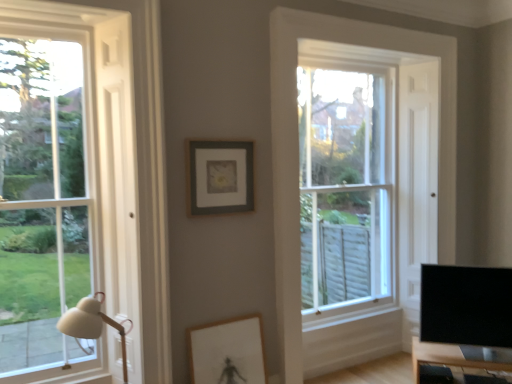
Question: Is clear glass window at left, positioned as the first window in left-to-right order, far away from matte wooden picture frame at center, acting as the 2th picture frame starting from the top?

Choices:
 (A) yes
 (B) no

Answer: (B)

Question: From a real-world perspective, does clear glass window at left, positioned as the first window in left-to-right order, stand above matte wooden picture frame at center, acting as the 2th picture frame starting from the top?

Choices:
 (A) yes
 (B) no

Answer: (A)

Question: From the image's perspective, is clear glass window at left, the second window positioned from the right, on matte wooden picture frame at center, acting as the 2th picture frame starting from the top?

Choices:
 (A) no
 (B) yes

Answer: (B)

Question: Is clear glass window at left, acting as the 2th window starting from the back, bigger than matte wooden picture frame at center, acting as the 2th picture frame starting from the top?

Choices:
 (A) yes
 (B) no

Answer: (A)

Question: Is the depth of clear glass window at left, the 1th window from the front, less than that of matte wooden picture frame at center, arranged as the 1th picture frame when ordered from the bottom?

Choices:
 (A) no
 (B) yes

Answer: (B)

Question: Does clear glass window at left, the second window positioned from the right, come behind matte wooden picture frame at center, arranged as the 1th picture frame when ordered from the bottom?

Choices:
 (A) yes
 (B) no

Answer: (B)

Question: Can you confirm if wooden table at lower right is positioned to the right of matte gray picture frame at center, which is counted as the 1th picture frame, starting from the top?

Choices:
 (A) no
 (B) yes

Answer: (B)

Question: Can we say wooden table at lower right lies outside matte gray picture frame at center, which ranks as the second picture frame in bottom-to-top order?

Choices:
 (A) no
 (B) yes

Answer: (B)

Question: Can you confirm if wooden table at lower right is positioned to the left of matte gray picture frame at center, which is counted as the 1th picture frame, starting from the top?

Choices:
 (A) yes
 (B) no

Answer: (B)

Question: Is there a large distance between wooden table at lower right and matte gray picture frame at center, which ranks as the second picture frame in bottom-to-top order?

Choices:
 (A) yes
 (B) no

Answer: (A)

Question: Does wooden table at lower right have a greater height compared to matte gray picture frame at center, which is counted as the 1th picture frame, starting from the top?

Choices:
 (A) yes
 (B) no

Answer: (B)

Question: From a real-world perspective, does wooden table at lower right stand above matte gray picture frame at center, which is counted as the 1th picture frame, starting from the top?

Choices:
 (A) no
 (B) yes

Answer: (A)

Question: Can you confirm if matte wooden picture frame at center, acting as the 2th picture frame starting from the top, is wider than wooden table at lower right?

Choices:
 (A) no
 (B) yes

Answer: (A)